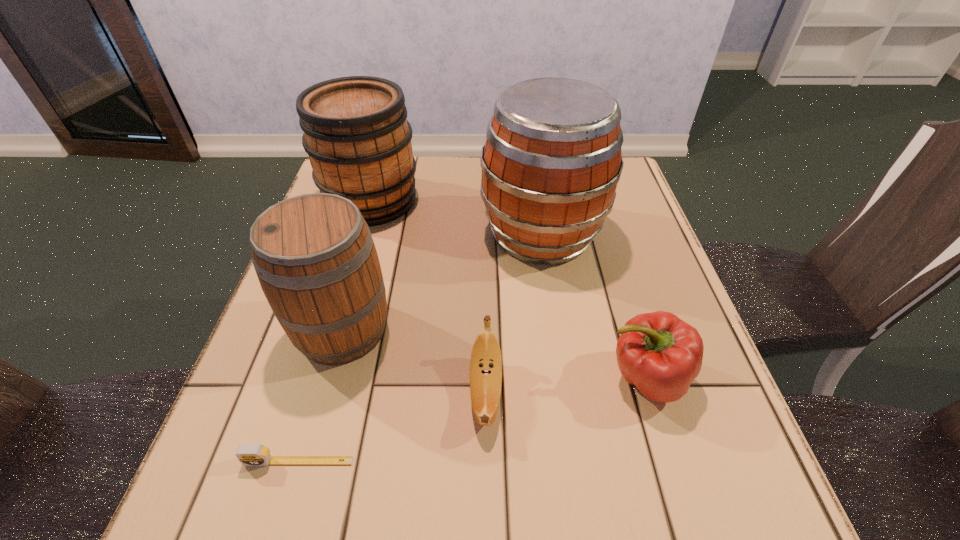
The width and height of the screenshot is (960, 540). In order to click on vacant space located 0.050m on the front of the banana in this screenshot , I will do `click(487, 470)`.

In order to click on tape measure located in the left edge section of the desktop in this screenshot , I will do `click(253, 454)`.

Locate an element on the screen. The height and width of the screenshot is (540, 960). cider present at the right edge is located at coordinates (552, 160).

This screenshot has height=540, width=960. Find the location of `bell pepper at the right edge`. bell pepper at the right edge is located at coordinates (660, 354).

Where is `object present at the far left corner`? This screenshot has width=960, height=540. object present at the far left corner is located at coordinates tap(357, 137).

Where is `object present at the far right corner`? object present at the far right corner is located at coordinates (552, 160).

In the image, there is a desktop. At what (x,y) coordinates should I click in order to perform the action: click on vacant region at the far edge. Please return your answer as a coordinate pair (x, y). Looking at the image, I should click on (418, 158).

This screenshot has width=960, height=540. In order to click on vacant space at the near edge of the desktop in this screenshot , I will do `click(348, 517)`.

I want to click on blank space at the right edge, so point(637,297).

Locate an element on the screen. Image resolution: width=960 pixels, height=540 pixels. free space between the tallest object and the nearest cider is located at coordinates (442, 282).